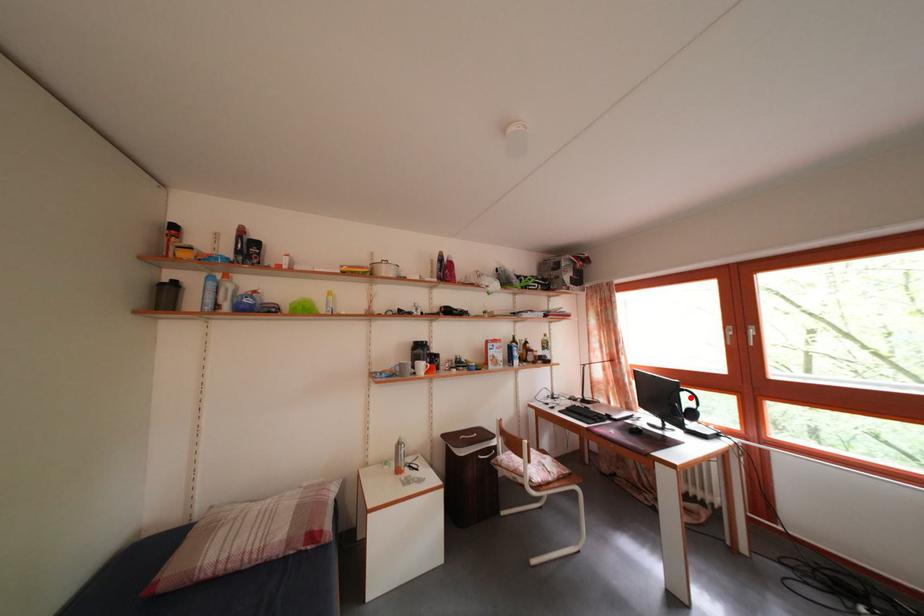
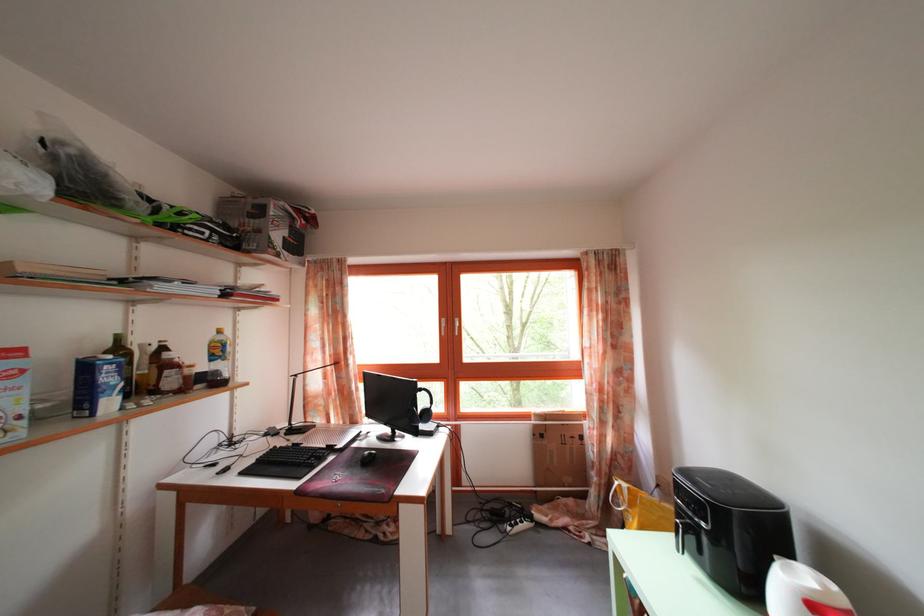
Find the pixel in the second image that matches the highlighted location in the first image.

(428, 397)